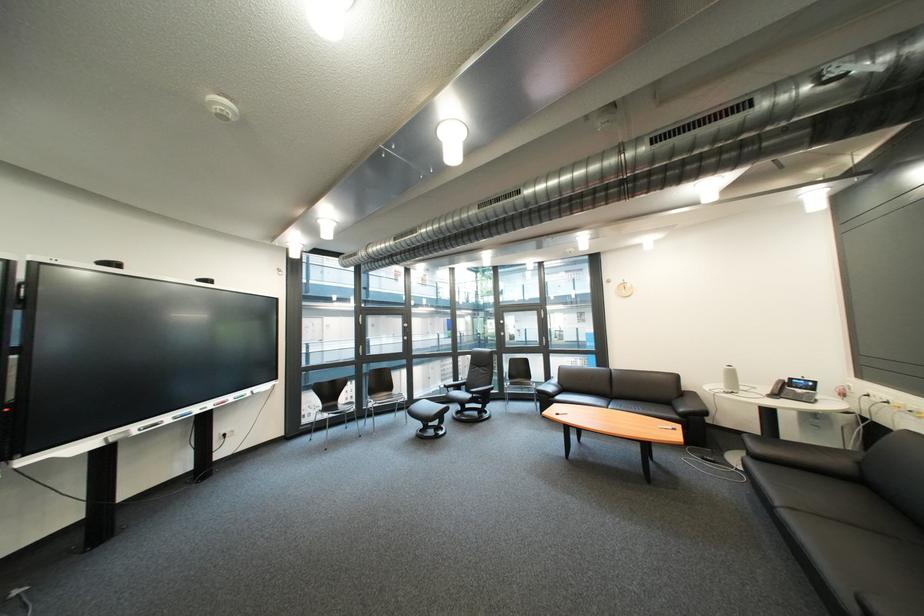
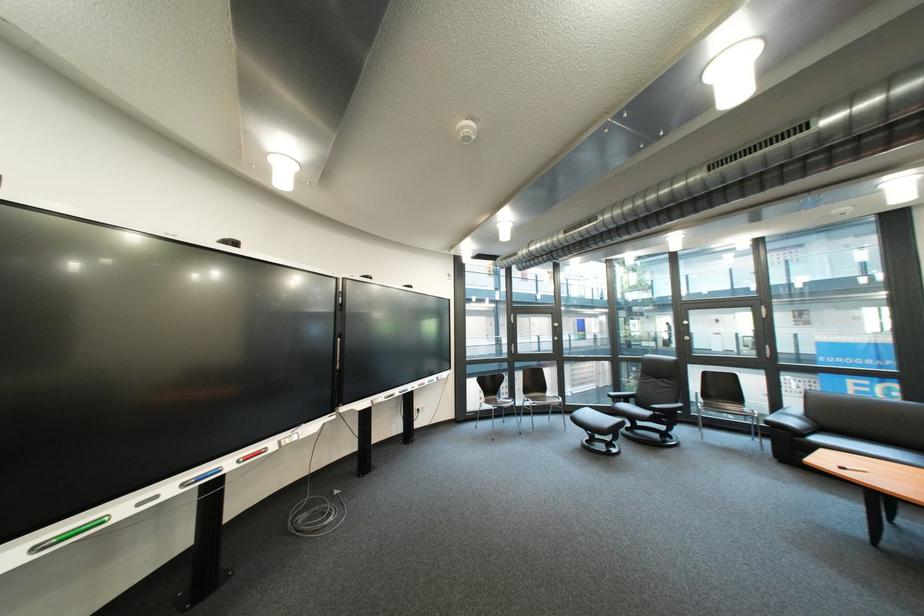
Find the pixel in the second image that matches point (359, 430) in the first image.

(517, 424)